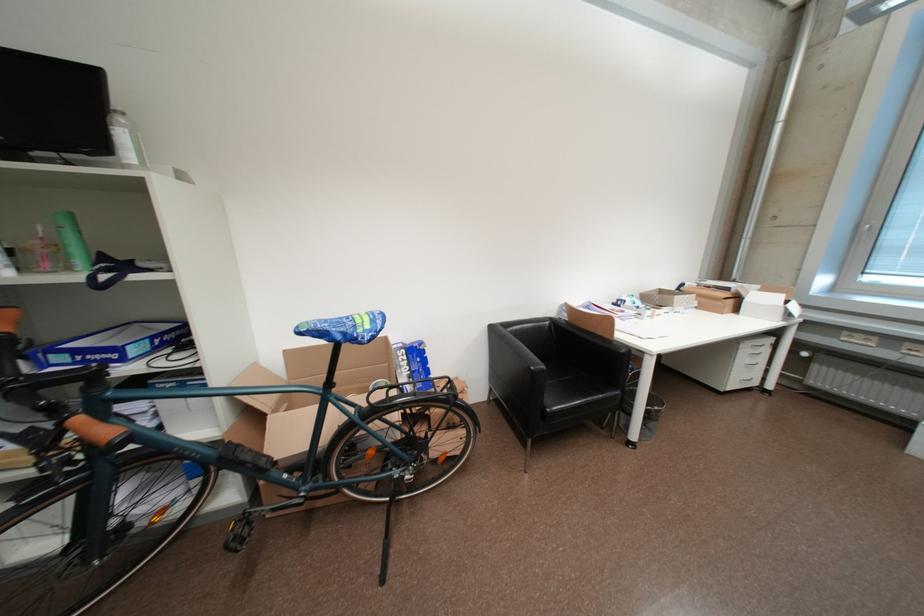
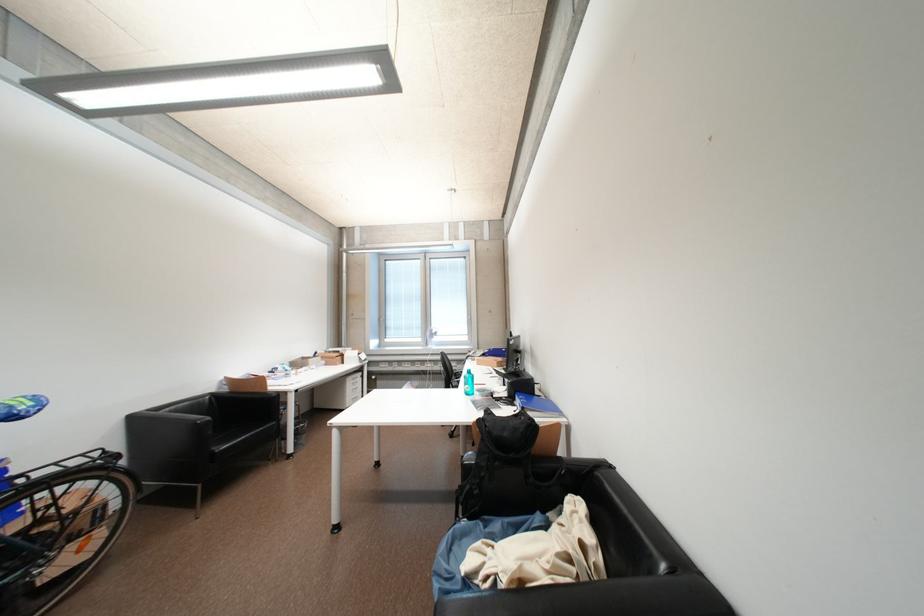
In the second image, find the point that corresponds to point (723, 301) in the first image.

(341, 360)